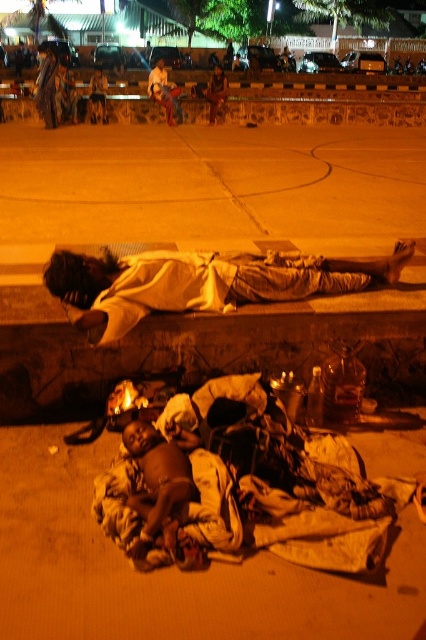
Question: Which point is closer to the camera?

Choices:
 (A) white clothed person at center
 (B) brown fabric blanket at lower center
 (C) dark skin baby at lower center

Answer: (B)

Question: From the image, what is the correct spatial relationship of brown fabric blanket at lower center in relation to white clothed person at center?

Choices:
 (A) below
 (B) above

Answer: (A)

Question: Which object appears closest to the camera in this image?

Choices:
 (A) white clothed person at center
 (B) brown fabric blanket at lower center

Answer: (B)

Question: Does brown fabric blanket at lower center have a lesser width compared to dark skin baby at lower center?

Choices:
 (A) no
 (B) yes

Answer: (A)

Question: Considering the relative positions of white clothed person at center and dark skin baby at lower center in the image provided, where is white clothed person at center located with respect to dark skin baby at lower center?

Choices:
 (A) left
 (B) right

Answer: (B)

Question: Among these points, which one is farthest from the camera?

Choices:
 (A) (377, 451)
 (B) (183, 506)
 (C) (118, 266)

Answer: (C)